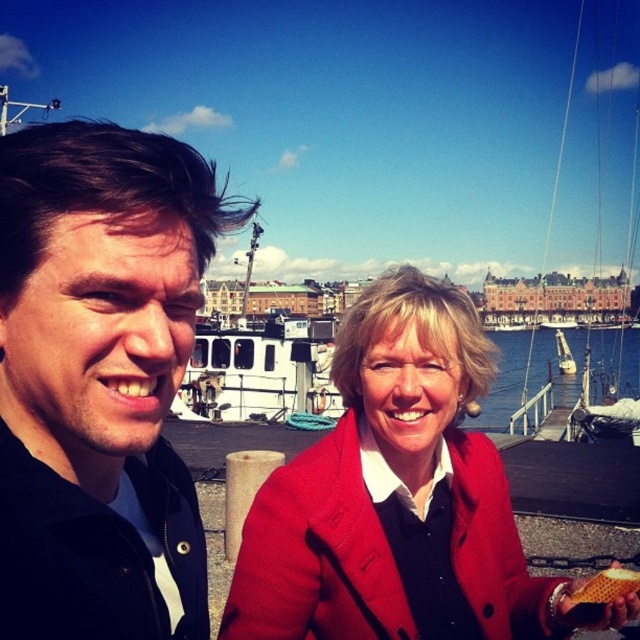
Describe the element at coordinates (241, 376) in the screenshot. Image resolution: width=640 pixels, height=640 pixels. I see `blue water at center` at that location.

Can you confirm if blue water at center is thinner than golden honeycomb at lower right?

No, blue water at center is not thinner than golden honeycomb at lower right.

The width and height of the screenshot is (640, 640). Find the location of `blue water at center`. blue water at center is located at coordinates (241, 376).

This screenshot has height=640, width=640. What are the coordinates of `blue water at center` in the screenshot? It's located at (241, 376).

Which is behind, point (417, 433) or point (221, 336)?

The point (221, 336) is more distant.

Does point (339, 465) come closer to viewer compared to point (518, 380)?

Yes, point (339, 465) is closer to viewer.

Between point (436, 364) and point (536, 348), which one is positioned behind?

Point (536, 348)

Find the location of a particular element. The height and width of the screenshot is (640, 640). matte red coat at center is located at coordinates (400, 499).

Is matte black jacket at left to the right of matte red coat at center from the viewer's perspective?

In fact, matte black jacket at left is to the left of matte red coat at center.

Between matte black jacket at left and matte red coat at center, which one has less height?

matte red coat at center

Is point (22, 486) farther from viewer compared to point (444, 346)?

No, it is not.

At what (x,y) coordinates should I click in order to perform the action: click on matte black jacket at left. Please return your answer as a coordinate pair (x, y). Looking at the image, I should click on (99, 376).